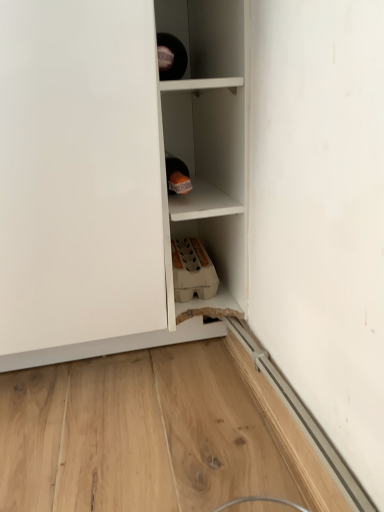
Question: From the image's perspective, is white matte cupboard at center positioned above or below white matte cabinet at center?

Choices:
 (A) below
 (B) above

Answer: (A)

Question: Would you say white matte cupboard at center is to the left or to the right of white matte cabinet at center in the picture?

Choices:
 (A) right
 (B) left

Answer: (B)

Question: Considering the positions of point (223, 33) and point (168, 272), is point (223, 33) closer or farther from the camera than point (168, 272)?

Choices:
 (A) farther
 (B) closer

Answer: (B)

Question: Considering the relative positions of white matte cabinet at center and white matte cupboard at center in the image provided, is white matte cabinet at center to the left or to the right of white matte cupboard at center?

Choices:
 (A) right
 (B) left

Answer: (A)

Question: From their relative heights in the image, would you say white matte cabinet at center is taller or shorter than white matte cupboard at center?

Choices:
 (A) short
 (B) tall

Answer: (B)

Question: From the image's perspective, is white matte cabinet at center positioned above or below white matte cupboard at center?

Choices:
 (A) above
 (B) below

Answer: (A)

Question: From a real-world perspective, is white matte cabinet at center above or below white matte cupboard at center?

Choices:
 (A) below
 (B) above

Answer: (A)